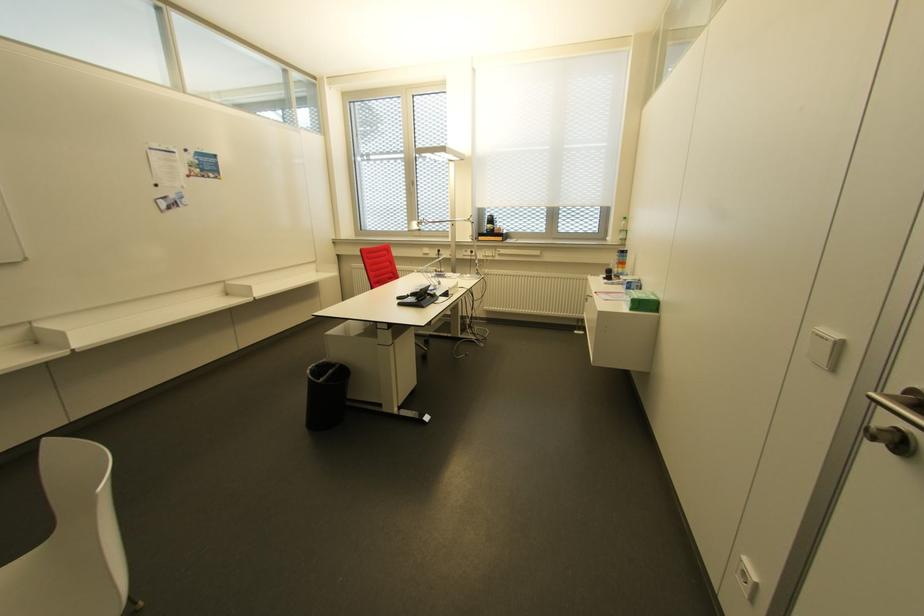
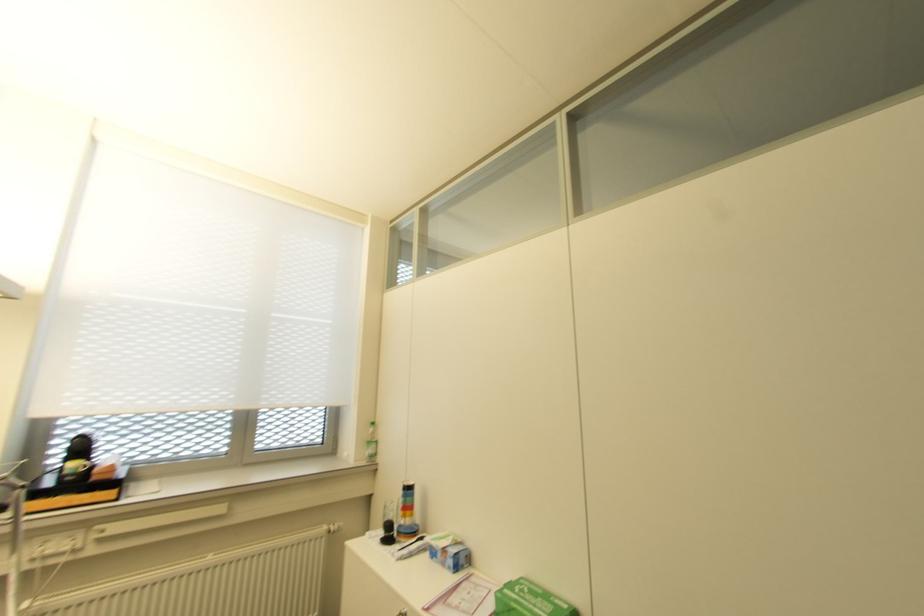
Locate, in the second image, the point that corresponds to the point at 626,289 in the first image.

(454, 568)